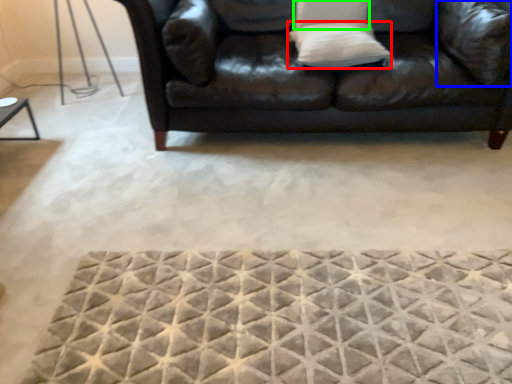
Question: Which is nearer to the pillow (highlighted by a red box)? pillow (highlighted by a blue box) or pillow (highlighted by a green box).

Choices:
 (A) pillow
 (B) pillow

Answer: (B)